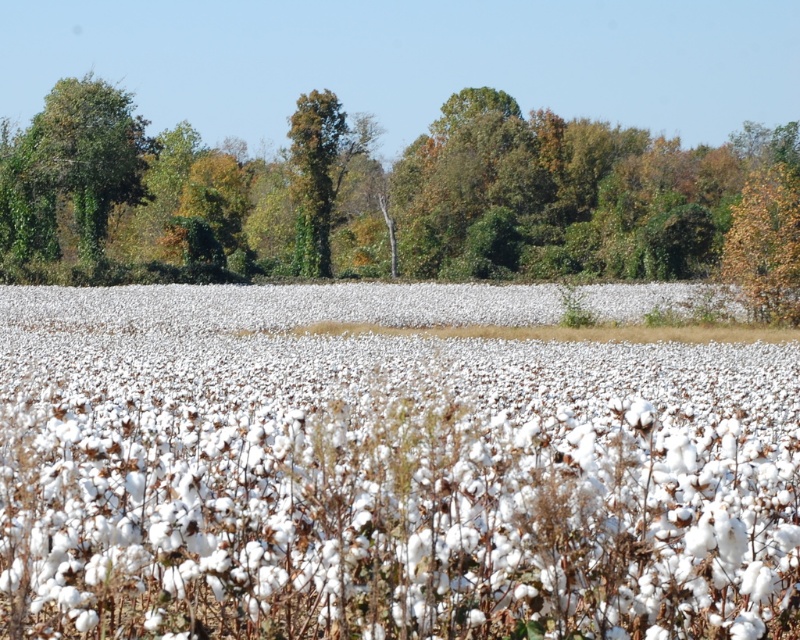
Can you confirm if green leafy tree at upper center is bigger than green leafy tree at center?

Correct, green leafy tree at upper center is larger in size than green leafy tree at center.

The height and width of the screenshot is (640, 800). Describe the element at coordinates (370, 196) in the screenshot. I see `green leafy tree at upper center` at that location.

Does point (548, 122) lie in front of point (318, 220)?

That is False.

What are the coordinates of `green leafy tree at upper center` in the screenshot? It's located at (370, 196).

Can you confirm if white fluffy cotton at center is shorter than green leafy tree at upper center?

Indeed, white fluffy cotton at center has a lesser height compared to green leafy tree at upper center.

Can you confirm if white fluffy cotton at center is taller than green leafy tree at upper center?

In fact, white fluffy cotton at center may be shorter than green leafy tree at upper center.

Image resolution: width=800 pixels, height=640 pixels. Describe the element at coordinates (384, 470) in the screenshot. I see `white fluffy cotton at center` at that location.

Locate an element on the screen. white fluffy cotton at center is located at coordinates (384, 470).

Can you confirm if green leafy tree at upper center is positioned below green leafy tree at upper left?

Correct, green leafy tree at upper center is located below green leafy tree at upper left.

Is green leafy tree at upper center positioned behind green leafy tree at upper left?

No, it is not.

Identify the location of green leafy tree at upper center. The image size is (800, 640). 370,196.

In order to click on green leafy tree at upper center in this screenshot , I will do `click(370, 196)`.